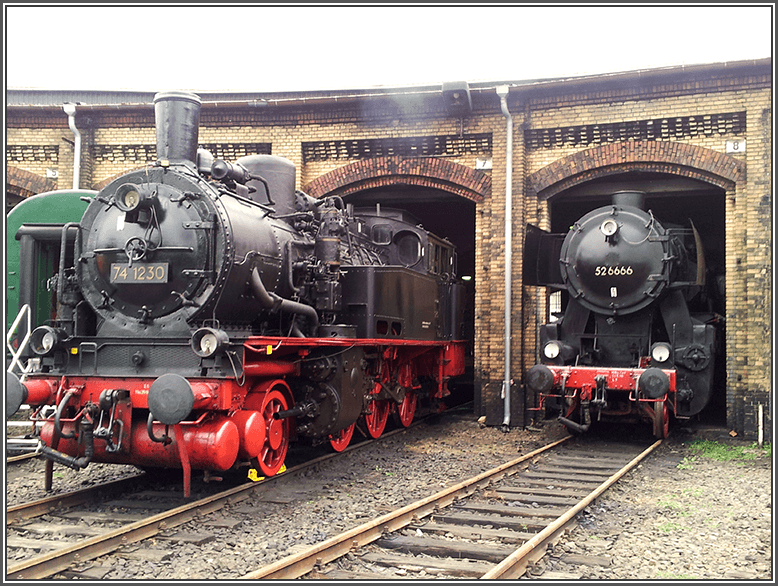
Locate an element on the screen. Image resolution: width=778 pixels, height=586 pixels. brick wall is located at coordinates (752, 241).